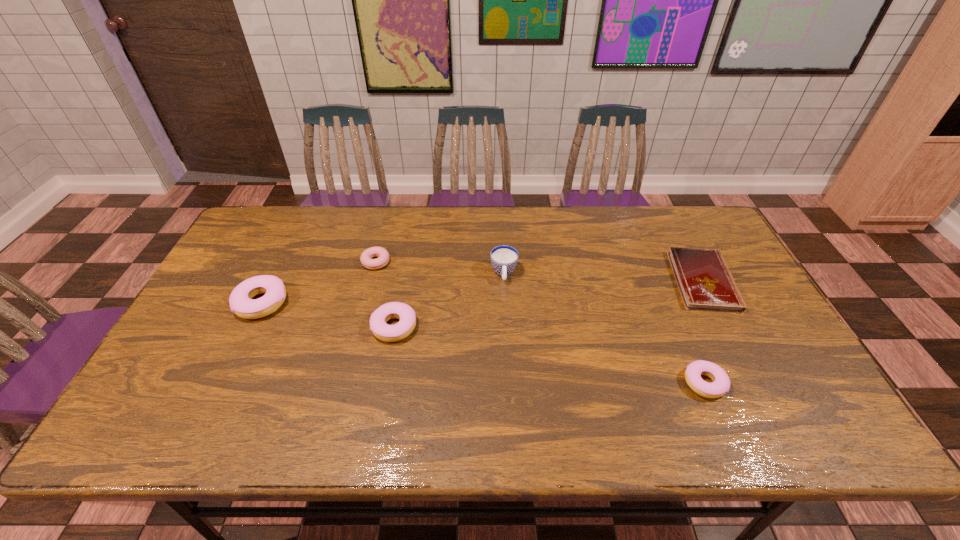
Please mark a free spot for a new doughnut to balance the arrangement. Please provide its 2D coordinates. Your answer should be formatted as a tuple, i.e. [(x, y)], where the tuple contains the x and y coordinates of a point satisfying the conditions above.

[(540, 353)]